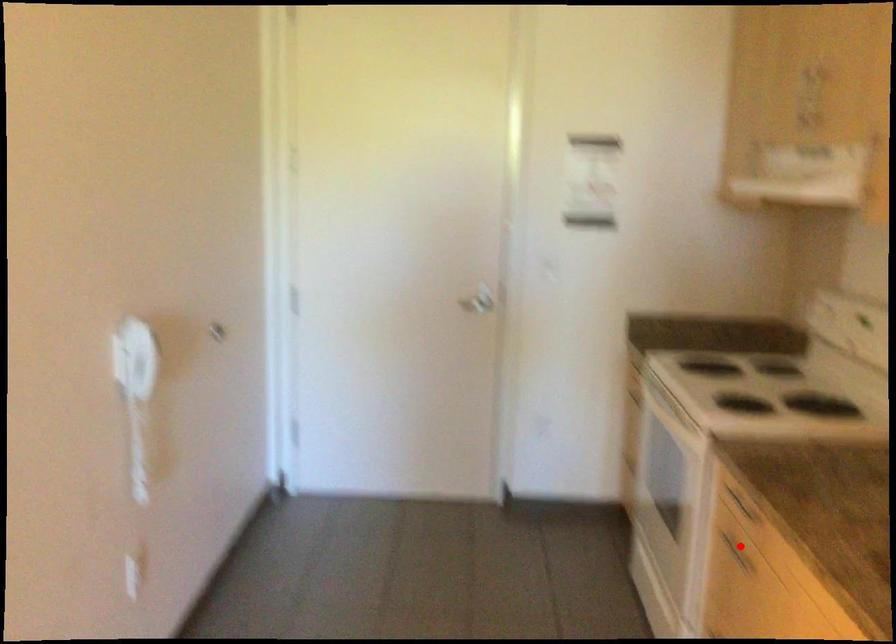
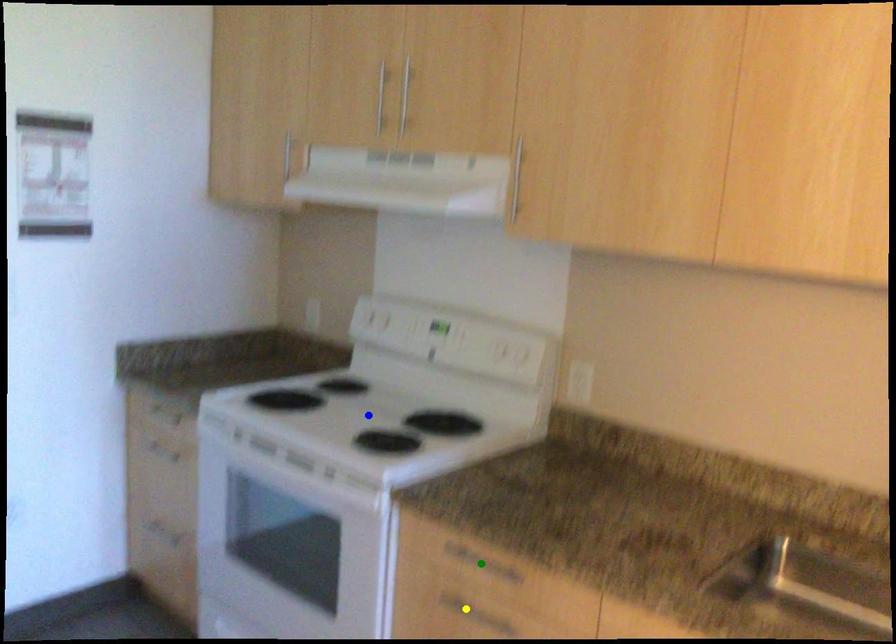
Question: I am providing you with two images of the same scene from different viewpoints. A red point is marked on the first image. You are given multiple points on the second image. Which mark in image 2 goes with the point in image 1?

Choices:
 (A) blue point
 (B) yellow point
 (C) green point

Answer: (B)